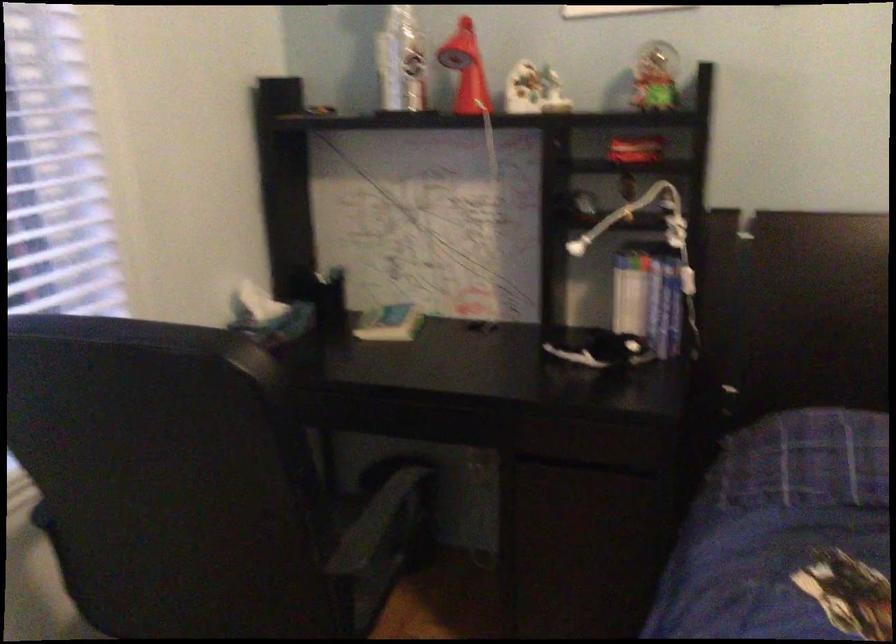
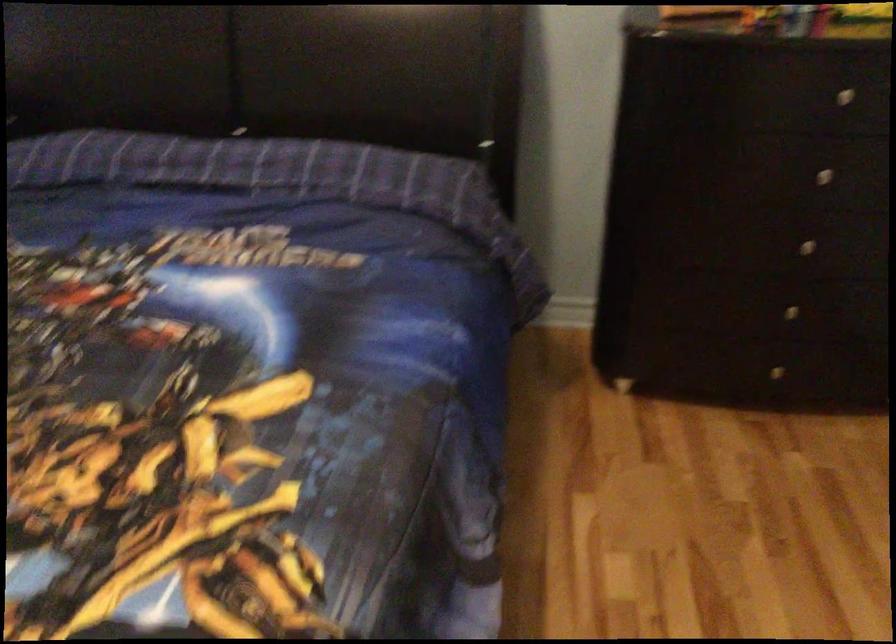
In a continuous first-person perspective shot, in which direction is the camera moving?

The movement direction of the cameraman is right, backward.